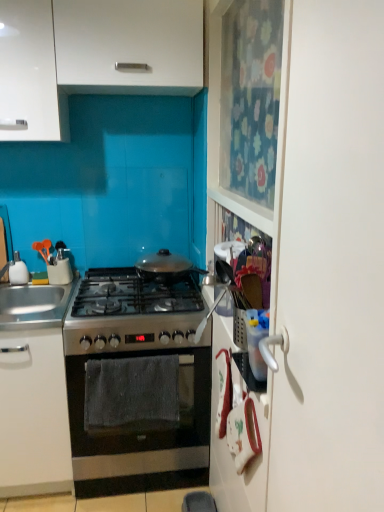
Question: Is stainless steel oven at center located outside white glossy soap dispenser at left?

Choices:
 (A) yes
 (B) no

Answer: (A)

Question: Is stainless steel oven at center wider than white glossy soap dispenser at left?

Choices:
 (A) yes
 (B) no

Answer: (A)

Question: Is stainless steel oven at center positioned before white glossy soap dispenser at left?

Choices:
 (A) yes
 (B) no

Answer: (A)

Question: Can you confirm if stainless steel oven at center is smaller than white glossy soap dispenser at left?

Choices:
 (A) no
 (B) yes

Answer: (A)

Question: Does stainless steel oven at center appear on the left side of white glossy soap dispenser at left?

Choices:
 (A) yes
 (B) no

Answer: (B)

Question: Based on their sizes in the image, would you say white glossy cabinet at upper left, which is the 2th cabinetry from bottom to top, is bigger or smaller than silver metallic sink at left?

Choices:
 (A) small
 (B) big

Answer: (B)

Question: Based on their positions, is white glossy cabinet at upper left, which is the 2th cabinetry from bottom to top, located to the left or right of silver metallic sink at left?

Choices:
 (A) right
 (B) left

Answer: (A)

Question: From a real-world perspective, is white glossy cabinet at upper left, which is the 2th cabinetry from bottom to top, above or below silver metallic sink at left?

Choices:
 (A) below
 (B) above

Answer: (B)

Question: From the image's perspective, is white glossy cabinet at upper left, which is the 2th cabinetry from bottom to top, above or below silver metallic sink at left?

Choices:
 (A) above
 (B) below

Answer: (A)

Question: In the image, is silver metallic sink at left positioned in front of or behind white matte cabinet at upper left, which is the 1th cabinetry from top to bottom?

Choices:
 (A) front
 (B) behind

Answer: (B)

Question: From the image's perspective, is silver metallic sink at left located above or below white matte cabinet at upper left, which is the 1th cabinetry from top to bottom?

Choices:
 (A) above
 (B) below

Answer: (B)

Question: Is silver metallic sink at left inside or outside of white matte cabinet at upper left, which is the 1th cabinetry from top to bottom?

Choices:
 (A) outside
 (B) inside

Answer: (A)

Question: In terms of size, does silver metallic sink at left appear bigger or smaller than white matte cabinet at upper left, the third cabinetry in the bottom-to-top sequence?

Choices:
 (A) small
 (B) big

Answer: (A)

Question: Which is correct: satin silver oven at center, the first cabinetry in the bottom-to-top sequence, is inside stainless steel oven at center, or outside of it?

Choices:
 (A) outside
 (B) inside

Answer: (A)

Question: Is satin silver oven at center, which is counted as the 3th cabinetry, starting from the top, bigger or smaller than stainless steel oven at center?

Choices:
 (A) big
 (B) small

Answer: (B)